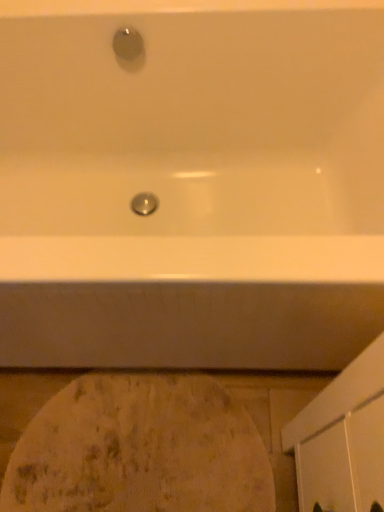
Find the location of a particular element. The image size is (384, 512). white textured rug at lower center is located at coordinates (140, 450).

This screenshot has width=384, height=512. Describe the element at coordinates (140, 450) in the screenshot. I see `white textured rug at lower center` at that location.

Measure the distance between point (112, 458) and camera.

The depth of point (112, 458) is 1.00 meters.

What are the coordinates of `white textured rug at lower center` in the screenshot? It's located at (140, 450).